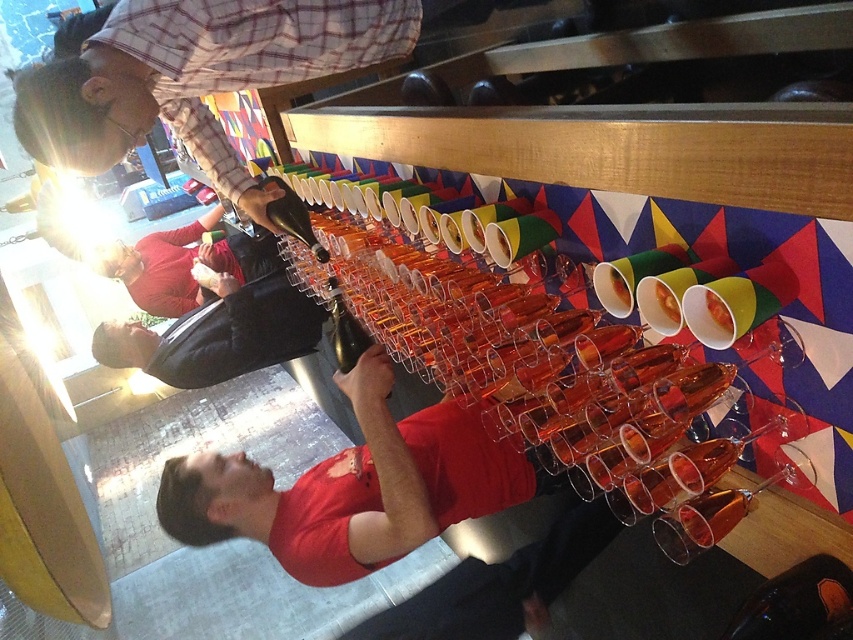
You are a bartender at the event and need to reach both the plaid shirt at upper left and the matte red sweater at lower left to offer drinks. Which of the two should you approach first if you want to serve the person closest to your current position?

You should approach the matte red sweater at lower left first because it is closer to your current position than the plaid shirt at upper left, which is located above it.

You are at a party and need to locate two people wearing distinct clothing items. The first person is wearing a plaid shirt at upper left, and the second is wearing a matte red sweater at lower left. If you are facing the scene, which clothing item is positioned more to the left?

The matte red sweater at lower left is positioned more to the left since the plaid shirt at upper left is to the right of it.

You are a bartender at the event and need to identify which clothing item is larger for a costume party. Which is larger between the plaid shirt at upper left and the matte red sweater at lower left?

The matte red sweater at lower left is larger than the plaid shirt at upper left.